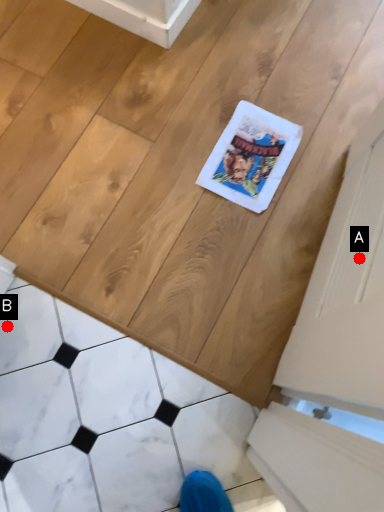
Question: Two points are circled on the image, labeled by A and B beside each circle. Which point is farther to the camera?

Choices:
 (A) A is further
 (B) B is further

Answer: (B)